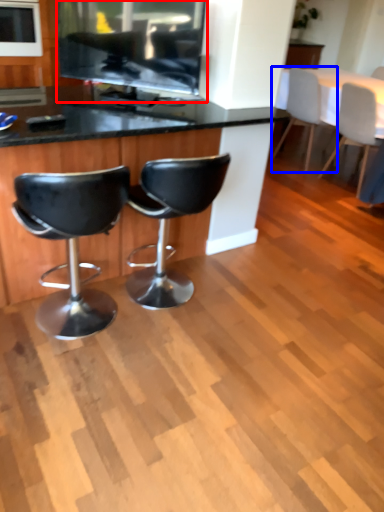
Question: Which object is further to the camera taking this photo, appliance (highlighted by a red box) or chair (highlighted by a blue box)?

Choices:
 (A) appliance
 (B) chair

Answer: (B)